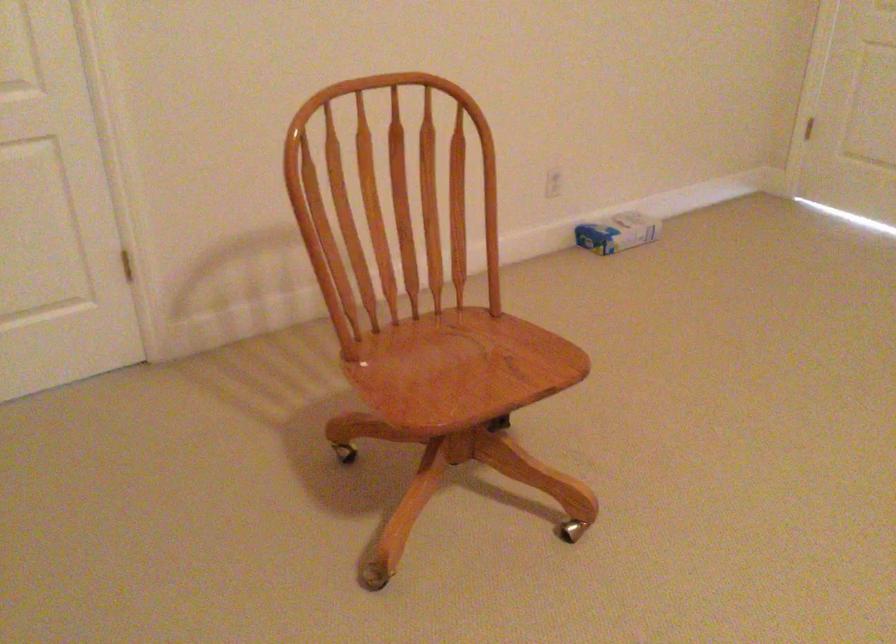
Describe the element at coordinates (428, 374) in the screenshot. The height and width of the screenshot is (644, 896). I see `a chair sitting surface` at that location.